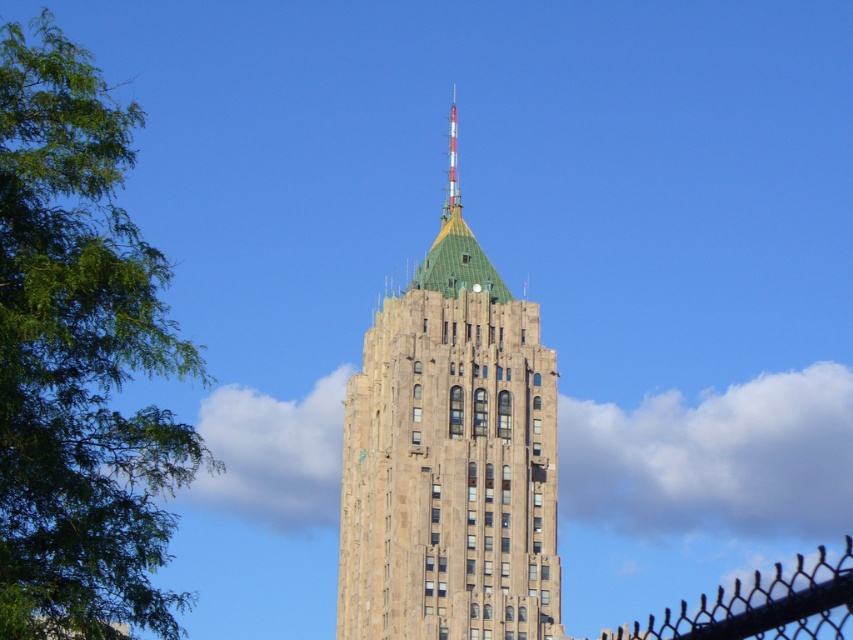
Question: Does black chain-link fence at lower right appear over white/red striped antenna at top?

Choices:
 (A) yes
 (B) no

Answer: (B)

Question: Among these objects, which one is nearest to the camera?

Choices:
 (A) white/red striped antenna at top
 (B) green leafy tree at left
 (C) brown stone building at center

Answer: (B)

Question: Is green leafy tree at left above black chain-link fence at lower right?

Choices:
 (A) no
 (B) yes

Answer: (B)

Question: Based on their relative distances, which object is nearer to the green leafy tree at left?

Choices:
 (A) brown stone building at center
 (B) black chain-link fence at lower right

Answer: (A)

Question: Can you confirm if brown stone building at center is thinner than black chain-link fence at lower right?

Choices:
 (A) no
 (B) yes

Answer: (B)

Question: Among these points, which one is farthest from the camera?

Choices:
 (A) (90, 154)
 (B) (538, 556)

Answer: (B)